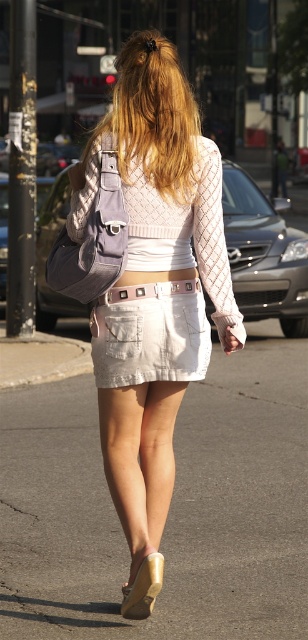
Locate an element on the screen. This screenshot has height=640, width=308. denim shorts at center is located at coordinates (150, 333).

Is denim shorts at center behind white leather belt at center?

Answer: No, denim shorts at center is closer to the viewer.

What do you see at coordinates (150, 333) in the screenshot? I see `denim shorts at center` at bounding box center [150, 333].

Find the location of a particular element. denim shorts at center is located at coordinates (150, 333).

Does light gray asphalt at center appear under blonde hair at upper center?

Yes.

I want to click on light gray asphalt at center, so click(170, 508).

Between point (218, 396) and point (137, 262), which one is positioned in front?

Point (137, 262)

Does point (86, 518) come in front of point (89, 145)?

That is False.

The width and height of the screenshot is (308, 640). What do you see at coordinates (170, 508) in the screenshot?
I see `light gray asphalt at center` at bounding box center [170, 508].

At what (x,y) coordinates should I click in order to perform the action: click on light gray asphalt at center. Please return your answer as a coordinate pair (x, y). The height and width of the screenshot is (640, 308). Looking at the image, I should click on (170, 508).